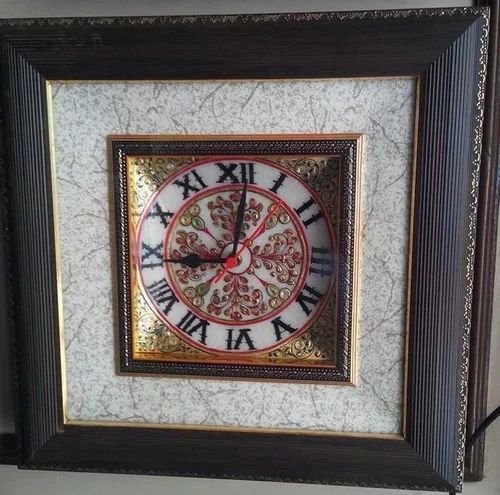
Locate an element on the screen. black hour hand, center is located at coordinates (188, 260).